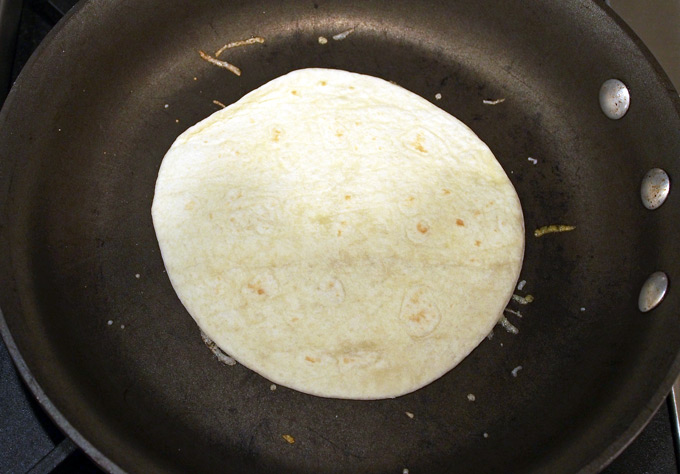
Where is `stovetop`? This screenshot has height=474, width=680. stovetop is located at coordinates (18, 431).